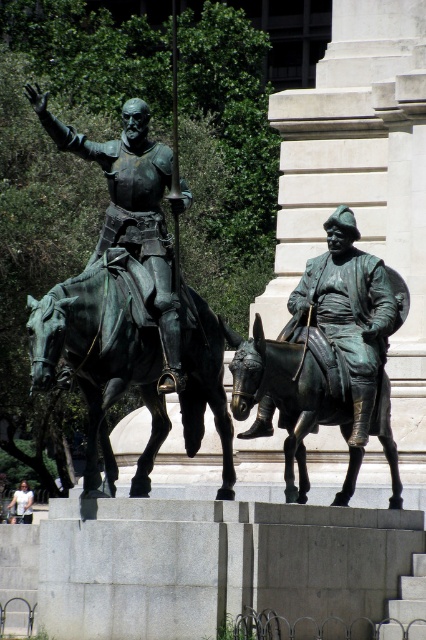
Which is in front, point (28, 304) or point (25, 483)?

Point (28, 304)

Looking at this image, who is taller, bronze statue of horse at left or white cotton shirt at lower left?

bronze statue of horse at left is taller.

I want to click on bronze statue of horse at left, so click(103, 355).

Does bronze statue of horse at left appear on the right side of bronze statue of donkey at center?

No, bronze statue of horse at left is not to the right of bronze statue of donkey at center.

Describe the element at coordinates (103, 355) in the screenshot. The width and height of the screenshot is (426, 640). I see `bronze statue of horse at left` at that location.

Between point (63, 340) and point (319, 422), which one is positioned behind?

Point (319, 422)

Image resolution: width=426 pixels, height=640 pixels. I want to click on bronze statue of horse at left, so click(103, 355).

Does bronze statue of donkey at center have a greater width compared to white cotton shirt at lower left?

Yes, bronze statue of donkey at center is wider than white cotton shirt at lower left.

Is bronze statue of donkey at center closer to the viewer compared to white cotton shirt at lower left?

Yes, it is.

This screenshot has height=640, width=426. What do you see at coordinates (285, 396) in the screenshot? I see `bronze statue of donkey at center` at bounding box center [285, 396].

The image size is (426, 640). Find the location of `bronze statue of donkey at center`. bronze statue of donkey at center is located at coordinates (285, 396).